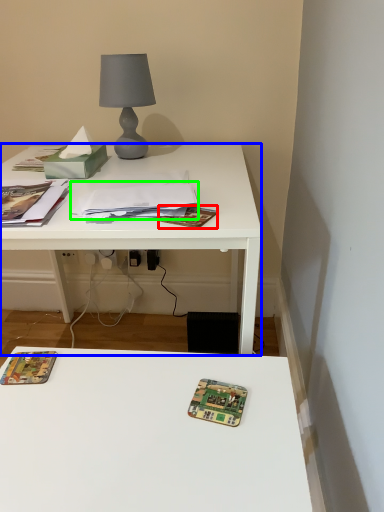
Question: Which is farther away from paperback book (highlighted by a red box)? desk (highlighted by a blue box) or journal (highlighted by a green box)?

Choices:
 (A) desk
 (B) journal

Answer: (A)